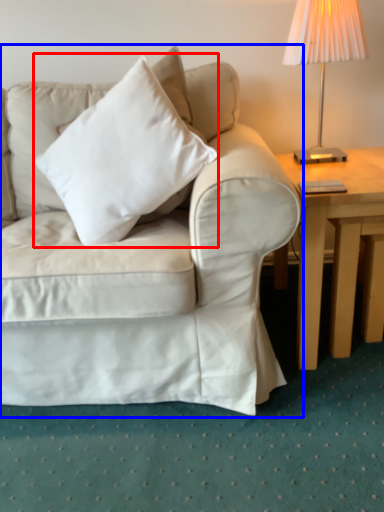
Question: Which object is closer to the camera taking this photo, pillow (highlighted by a red box) or studio couch (highlighted by a blue box)?

Choices:
 (A) pillow
 (B) studio couch

Answer: (B)